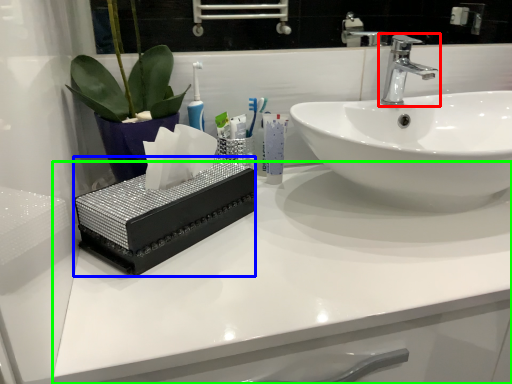
Question: Which is nearer to the tap (highlighted by a red box)? box (highlighted by a blue box) or counter top (highlighted by a green box).

Choices:
 (A) box
 (B) counter top

Answer: (B)